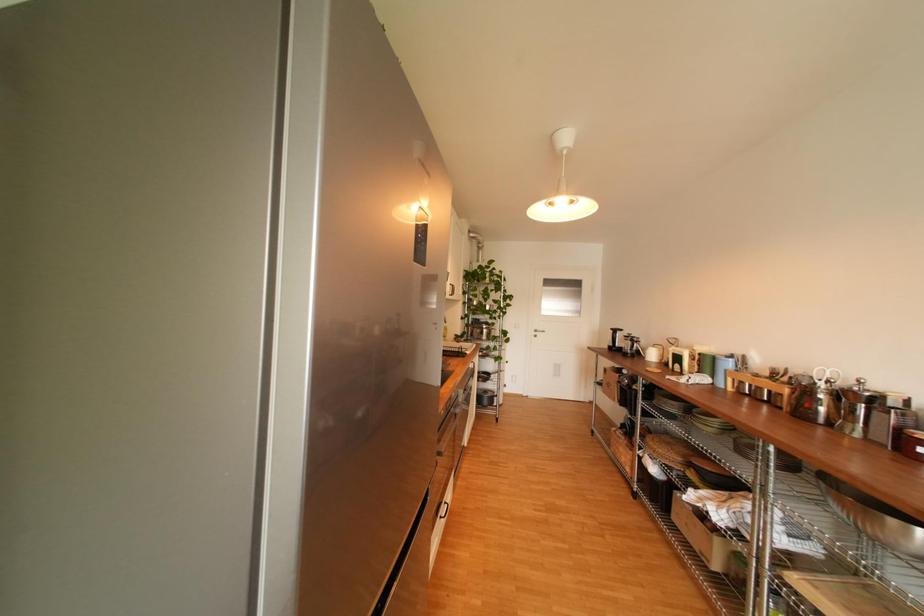
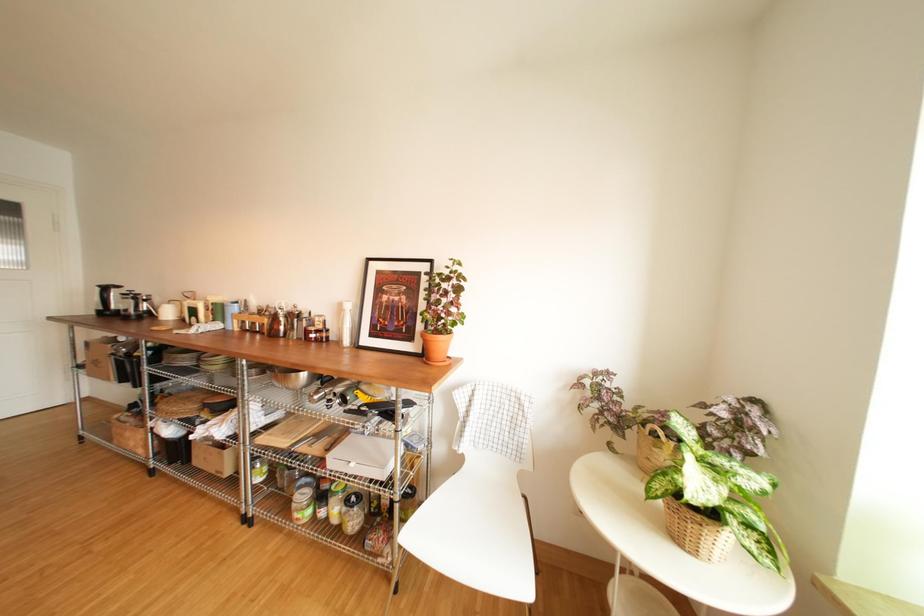
Question: The camera is either moving clockwise (left) or counter-clockwise (right) around the object. The first image is from the beginning of the video and the second image is from the end. Is the camera moving left or right when shooting the video?

Choices:
 (A) Left
 (B) Right

Answer: (A)